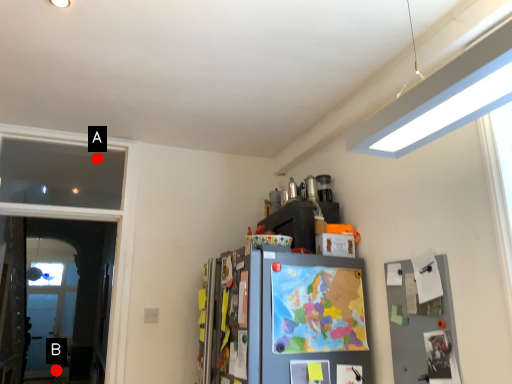
Question: Two points are circled on the image, labeled by A and B beside each circle. Which point appears farthest from the camera in this image?

Choices:
 (A) A is further
 (B) B is further

Answer: (B)